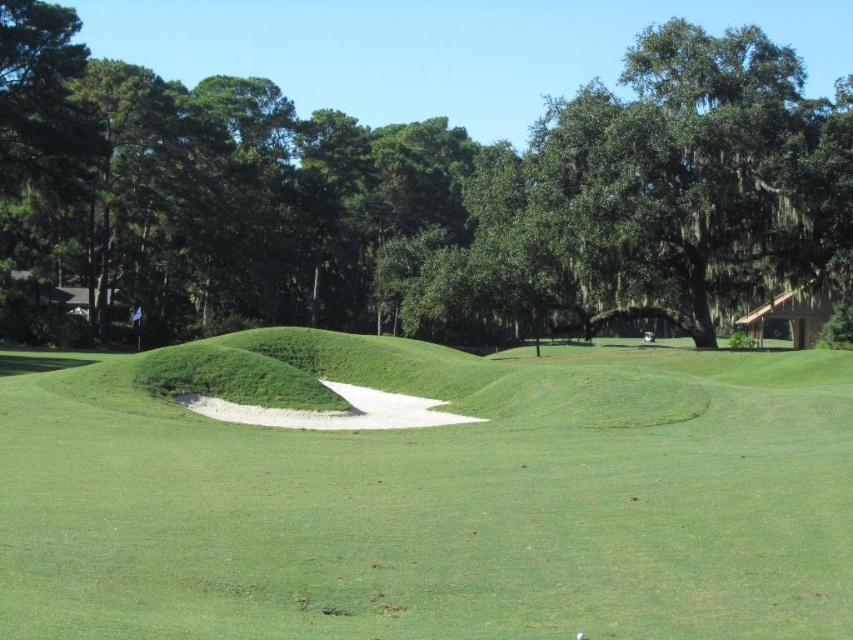
Question: Does green sand bunker at center appear over green leafy tree at center?

Choices:
 (A) yes
 (B) no

Answer: (B)

Question: Which of the following is the closest to the observer?

Choices:
 (A) green leafy tree at center
 (B) green sand bunker at center

Answer: (B)

Question: Does green sand bunker at center have a smaller size compared to green leafy tree at center?

Choices:
 (A) yes
 (B) no

Answer: (A)

Question: Among these objects, which one is nearest to the camera?

Choices:
 (A) green sand bunker at center
 (B) green leafy tree at center

Answer: (A)

Question: Is green sand bunker at center smaller than green leafy tree at center?

Choices:
 (A) no
 (B) yes

Answer: (B)